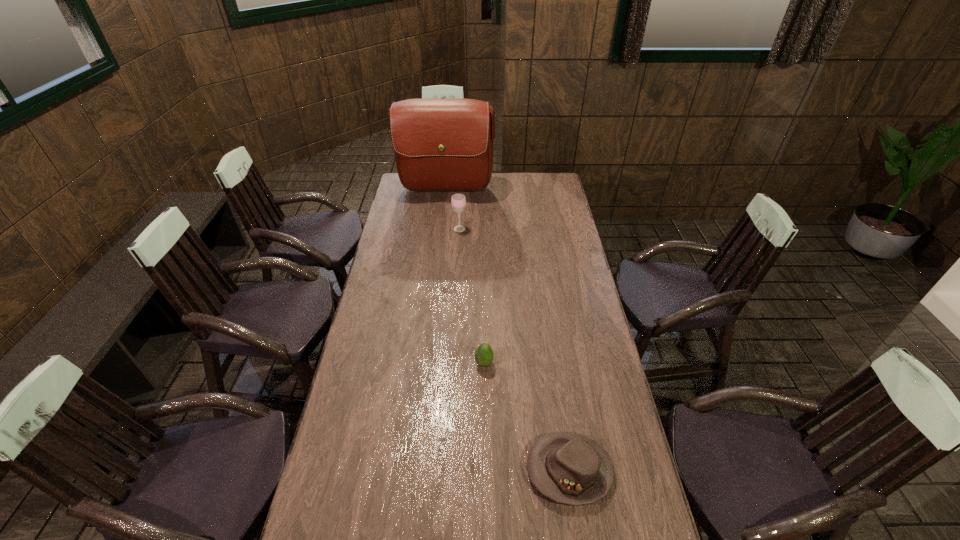
Find the location of `object that ranks as the third closest to the rightmost object`. object that ranks as the third closest to the rightmost object is located at coordinates (439, 144).

The height and width of the screenshot is (540, 960). What are the coordinates of `the second closest object to the tallest object` in the screenshot? It's located at (484, 355).

Image resolution: width=960 pixels, height=540 pixels. Find the location of `vacant space that satisfies the following two spatial constraints: 1. on the open flap of the second farthest object; 2. on the right side of the farthest object`. vacant space that satisfies the following two spatial constraints: 1. on the open flap of the second farthest object; 2. on the right side of the farthest object is located at coordinates (442, 229).

Locate an element on the screen. This screenshot has height=540, width=960. free point that satisfies the following two spatial constraints: 1. on the open flap of the farthest object; 2. on the right side of the second farthest object is located at coordinates (442, 229).

The height and width of the screenshot is (540, 960). Find the location of `free location that satisfies the following two spatial constraints: 1. on the open flap of the avocado; 2. on the right side of the tallest object`. free location that satisfies the following two spatial constraints: 1. on the open flap of the avocado; 2. on the right side of the tallest object is located at coordinates (427, 363).